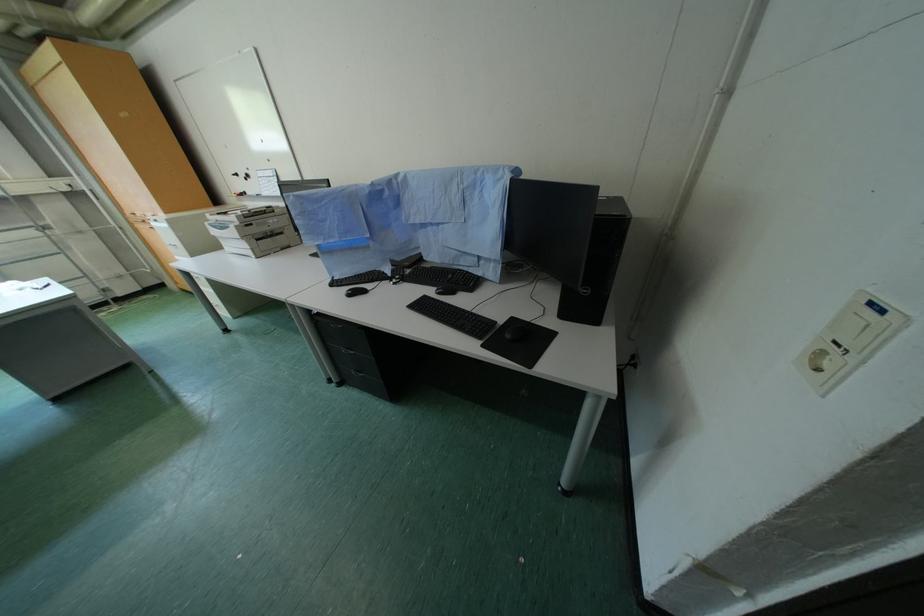
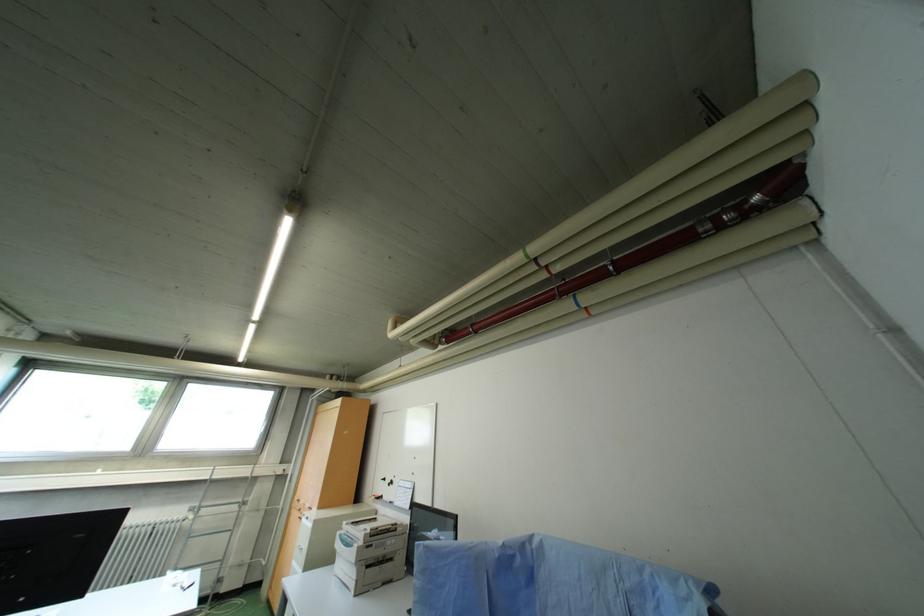
The images are taken continuously from a first-person perspective. In which direction is your viewpoint rotating?

The rotation direction of the camera is left-up.